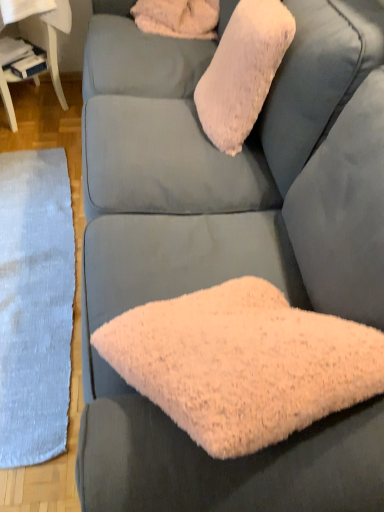
Identify the location of empty space that is ontop of gray woolen mat at left (from a real-world perspective). The width and height of the screenshot is (384, 512). (33, 258).